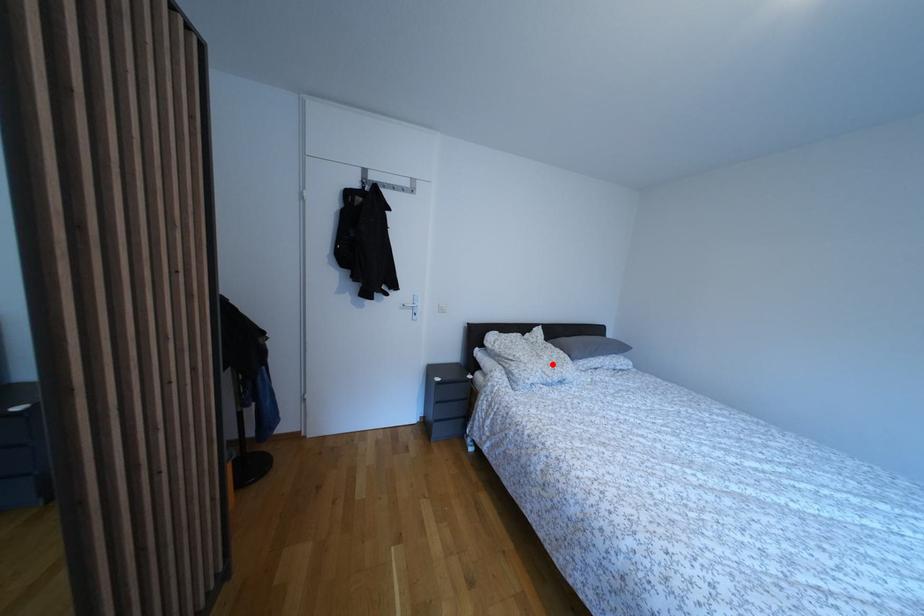
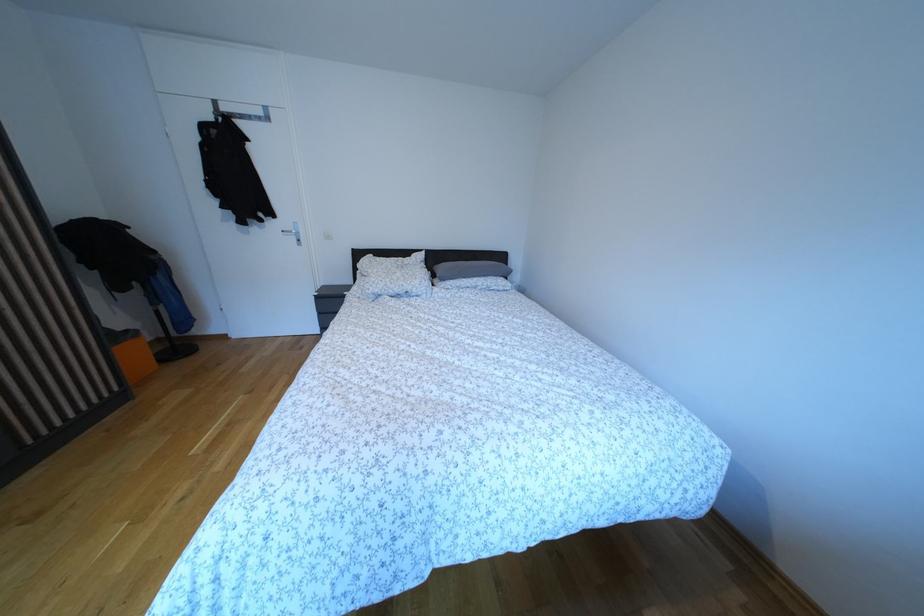
Where in the second image is the point corresponding to the highlighted location from the first image?

(406, 281)